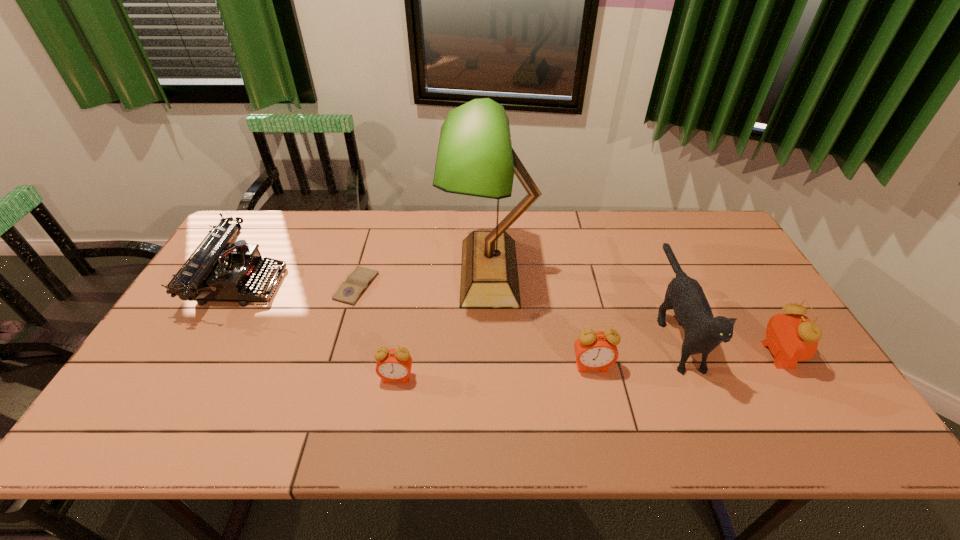
You are a GUI agent. You are given a task and a screenshot of the screen. Output one action in this format:
    pyautogui.click(x=<x>, y=<y>)
    Task: Click on the leftmost alarm clock
    The image size is (960, 540).
    Given the screenshot: What is the action you would take?
    (394, 365)

I want to click on the third object from left to right, so [x=394, y=365].

Where is `the fifth object from left to right`? the fifth object from left to right is located at coordinates (595, 350).

Identify the location of the second alarm clock from right to left. The height and width of the screenshot is (540, 960). (595, 350).

At what (x,y) coordinates should I click in order to perform the action: click on the rightmost object. Please return your answer as a coordinate pair (x, y). This screenshot has width=960, height=540. Looking at the image, I should click on (793, 337).

Identify the location of the fourth object from left to right. (475, 157).

The image size is (960, 540). What are the coordinates of `table lamp` in the screenshot? It's located at (475, 157).

Find the location of `the second object from left to right`. the second object from left to right is located at coordinates (349, 292).

Find the location of a particular element. The width and height of the screenshot is (960, 540). diary is located at coordinates (349, 292).

The width and height of the screenshot is (960, 540). Identify the location of the leftmost object. (223, 269).